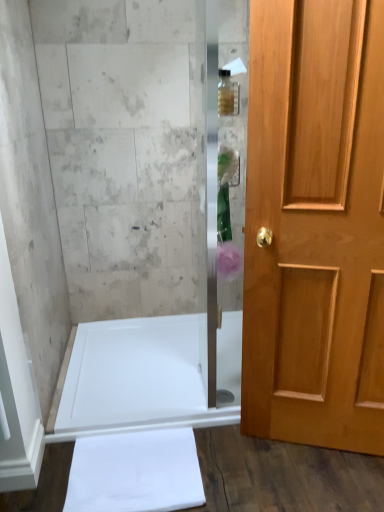
This screenshot has height=512, width=384. Identify the location of unoccupied area in front of light brown wooden door at right. (318, 484).